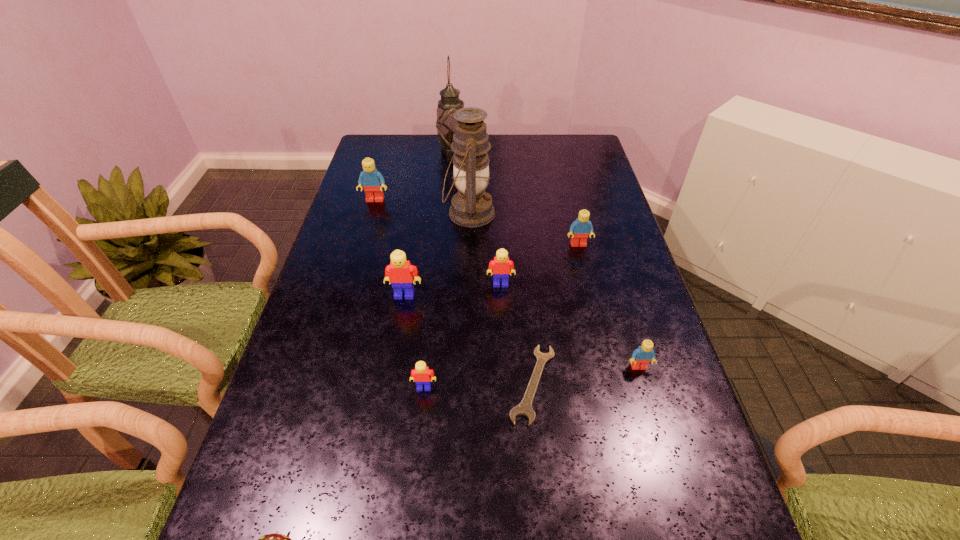
Identify the location of blue Lego that can be found as the second closest to the second shortest object. This screenshot has height=540, width=960. (580, 229).

In order to click on blue Lego that is the third nearest to the biggest yellow Lego in this screenshot , I will do `click(642, 356)`.

Locate an element on the screen. yellow Lego object that ranks as the second closest to the farthest yellow Lego is located at coordinates (421, 375).

Where is `yellow Lego that is the second closest to the smallest yellow Lego`? The height and width of the screenshot is (540, 960). yellow Lego that is the second closest to the smallest yellow Lego is located at coordinates (501, 265).

Locate an element on the screen. Image resolution: width=960 pixels, height=540 pixels. free space that satisfies the following two spatial constraints: 1. on the face of the blue oil lamp; 2. on the right side of the biggest blue Lego is located at coordinates (372, 213).